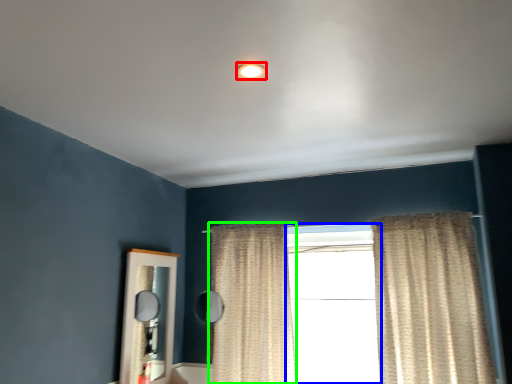
Question: Which is farther away from lighting (highlighted by a red box)? window (highlighted by a blue box) or curtain (highlighted by a green box)?

Choices:
 (A) window
 (B) curtain

Answer: (A)